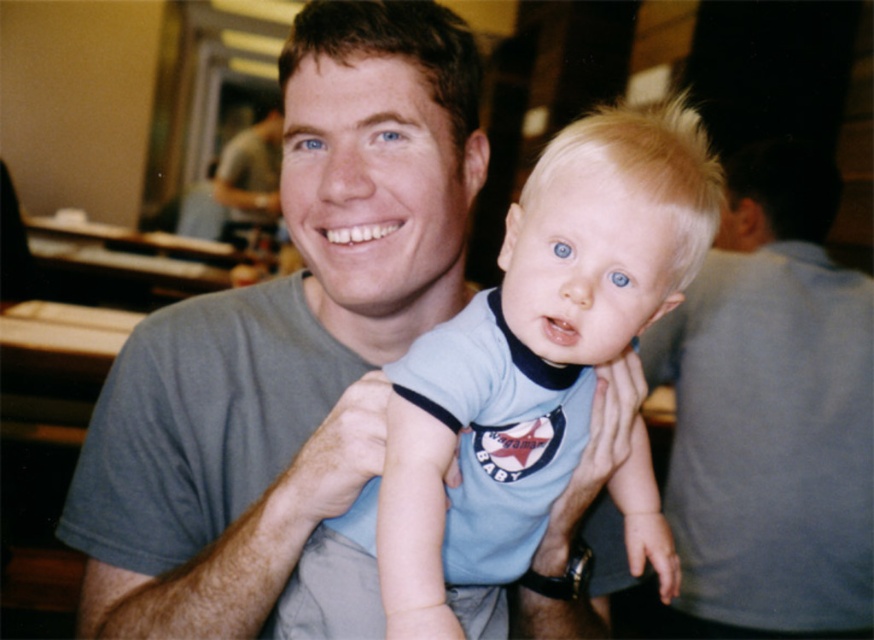
Question: Is gray cotton shirt at center closer to the viewer compared to light blue cotton shirt at center?

Choices:
 (A) yes
 (B) no

Answer: (B)

Question: Which object is farther from the camera taking this photo?

Choices:
 (A) gray cotton shirt at center
 (B) light blue cotton shirt at center

Answer: (A)

Question: Can you confirm if gray cotton shirt at center is wider than light blue cotton shirt at center?

Choices:
 (A) no
 (B) yes

Answer: (B)

Question: Can you confirm if gray cotton shirt at center is thinner than light blue cotton shirt at center?

Choices:
 (A) yes
 (B) no

Answer: (B)

Question: Among these points, which one is nearest to the camera?

Choices:
 (A) (539, 164)
 (B) (302, 337)

Answer: (A)